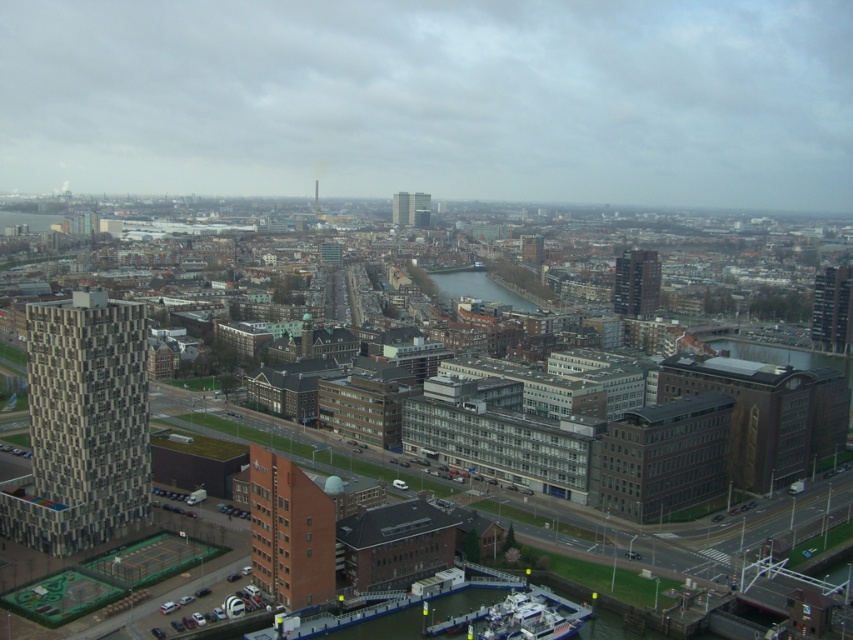
Question: Which point appears closest to the camera in this image?

Choices:
 (A) (408, 204)
 (B) (642, 275)

Answer: (B)

Question: Which object is positioned farthest from the dark gray concrete skyscraper at center-right?

Choices:
 (A) textured gray building at left
 (B) matte gray building at center

Answer: (A)

Question: Based on their relative distances, which object is farther from the matte gray building at center?

Choices:
 (A) dark blue water at center
 (B) dark gray concrete building at right

Answer: (B)

Question: Does dark gray concrete skyscraper at center-right appear on the right side of matte gray building at center?

Choices:
 (A) no
 (B) yes

Answer: (B)

Question: Is textured gray building at left below dark blue water at center?

Choices:
 (A) no
 (B) yes

Answer: (B)

Question: Is textured gray building at left wider than dark gray concrete skyscraper at center-right?

Choices:
 (A) no
 (B) yes

Answer: (A)